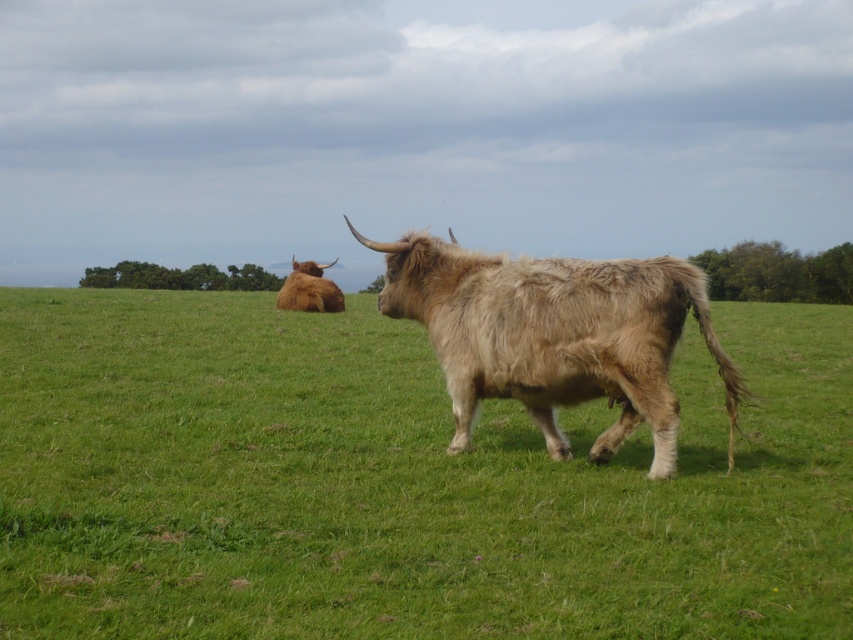
Question: Can you confirm if fuzzy beige buffalo at center is wider than brown fuzzy yak at upper left?

Choices:
 (A) no
 (B) yes

Answer: (A)

Question: Which point appears closest to the camera in this image?

Choices:
 (A) (486, 310)
 (B) (312, 268)
 (C) (590, 515)

Answer: (C)

Question: Which object is the farthest from the fuzzy beige buffalo at center?

Choices:
 (A) brown fuzzy yak at upper left
 (B) green soft grass at center

Answer: (A)

Question: Which of these objects is positioned farthest from the brown fuzzy yak at upper left?

Choices:
 (A) green soft grass at center
 (B) fuzzy beige buffalo at center

Answer: (B)

Question: Does fuzzy beige buffalo at center come in front of brown fuzzy yak at upper left?

Choices:
 (A) yes
 (B) no

Answer: (A)

Question: Is green soft grass at center closer to the viewer compared to fuzzy beige buffalo at center?

Choices:
 (A) no
 (B) yes

Answer: (B)